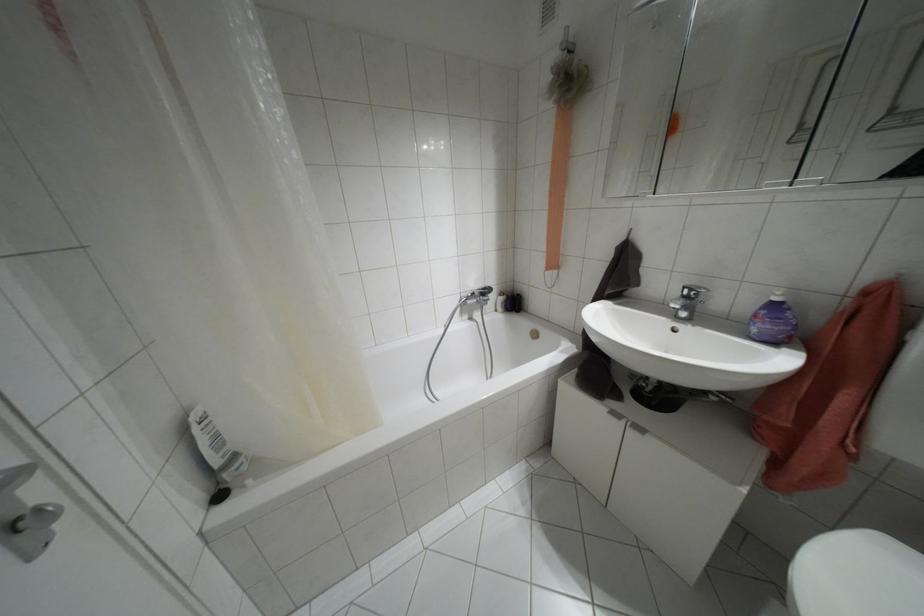
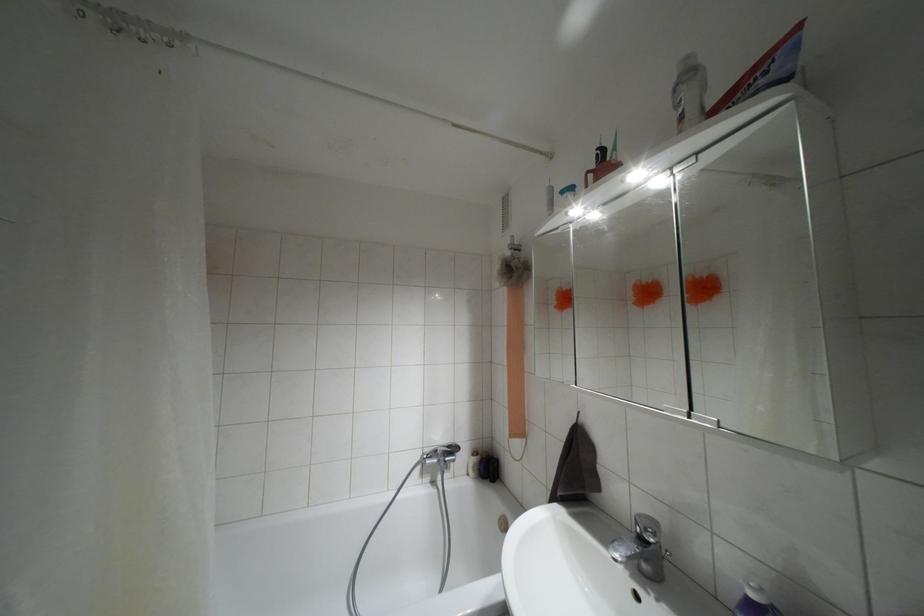
In the second image, find the point that corresponds to (774,299) in the first image.

(751, 594)